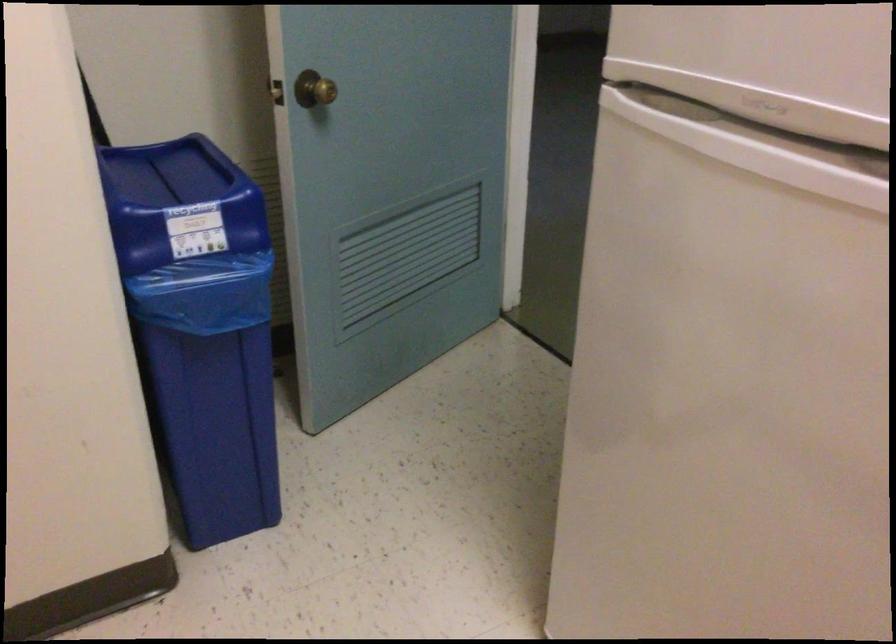
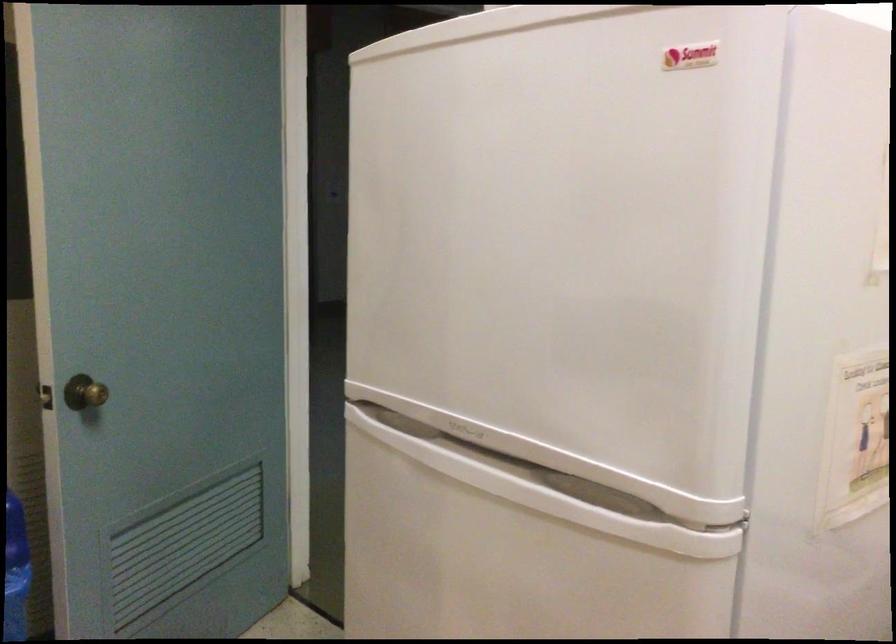
Based on the photo, which direction would the cameraman need to move to produce the second image?

The cameraman walked toward right, backward.